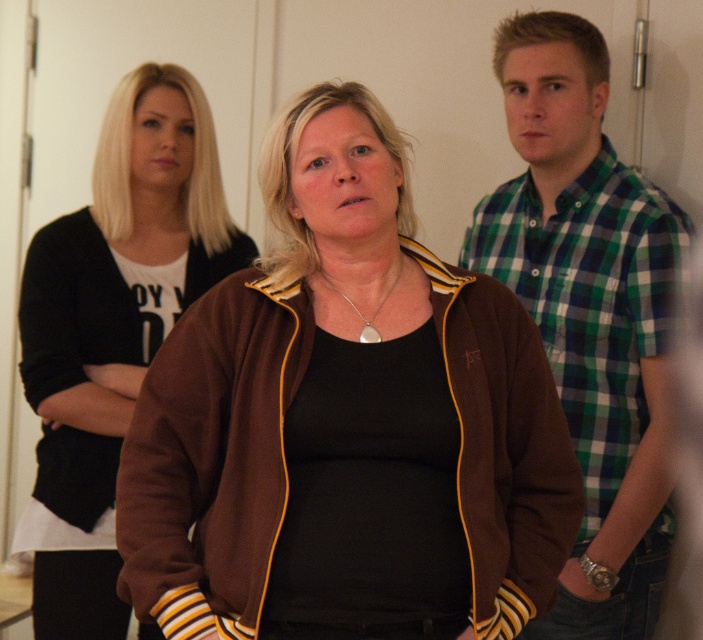
You are a fashion designer analyzing clothing items in the image. The green plaid shirt at right and brown fleece jacket at center are both part of the collection. Which one has a longer length?

The green plaid shirt at right is taller than brown fleece jacket at center, so the green plaid shirt at right has a longer length.

You are a photographer setting up for a group photo. You notice the green plaid shirt at right and the brown fleece jacket at center. Which clothing item should you focus on first to ensure it is in sharp focus if you want both in the frame?

The green plaid shirt at right is further to the viewer than the brown fleece jacket at center, so you should focus on the green plaid shirt at right first to ensure proper depth of field for both.